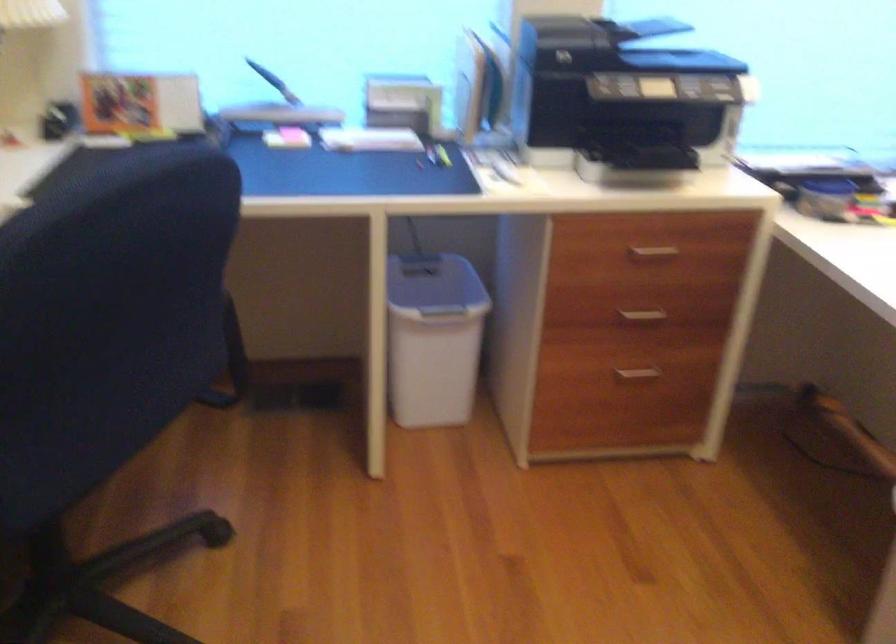
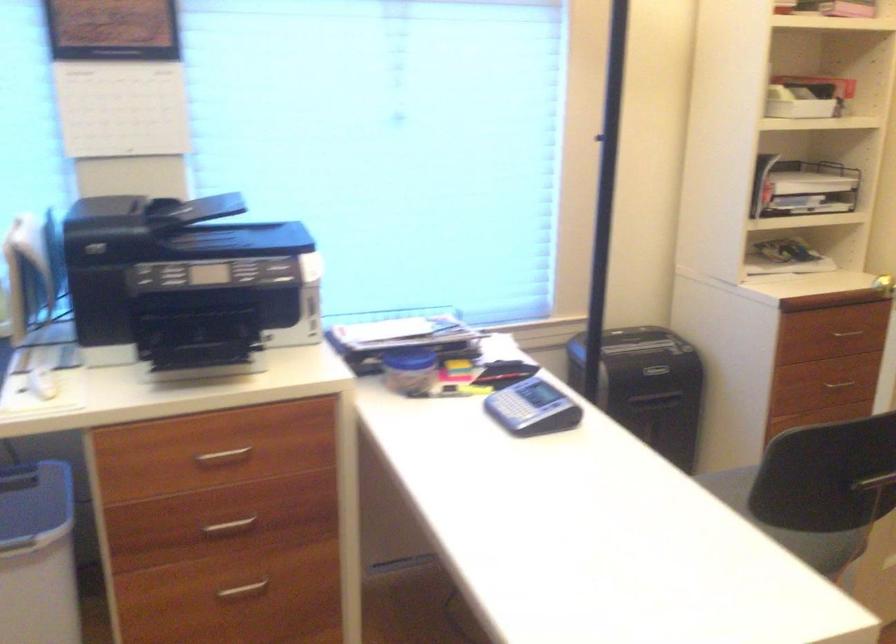
Where in the second image is the point corresponding to point 824,182 from the first image?

(409, 359)